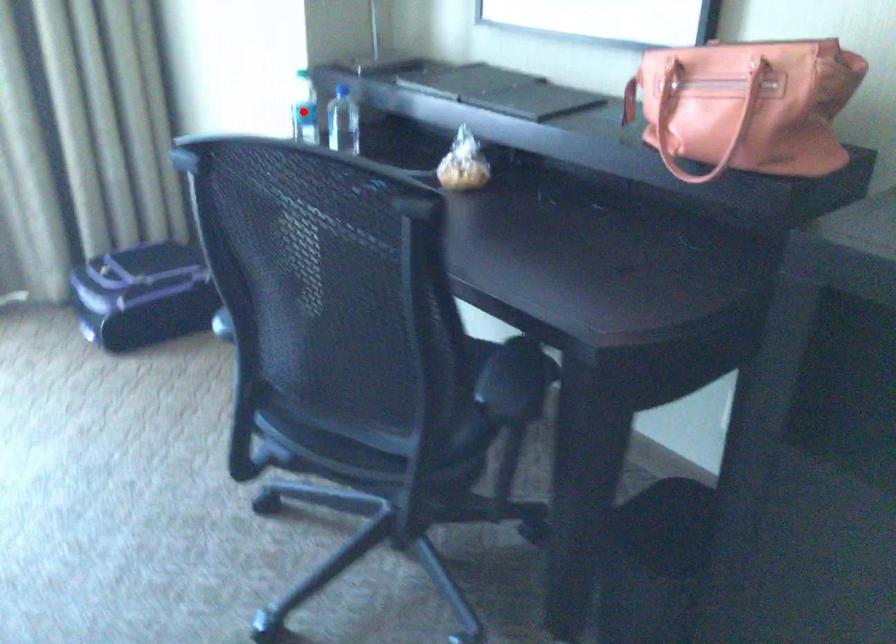
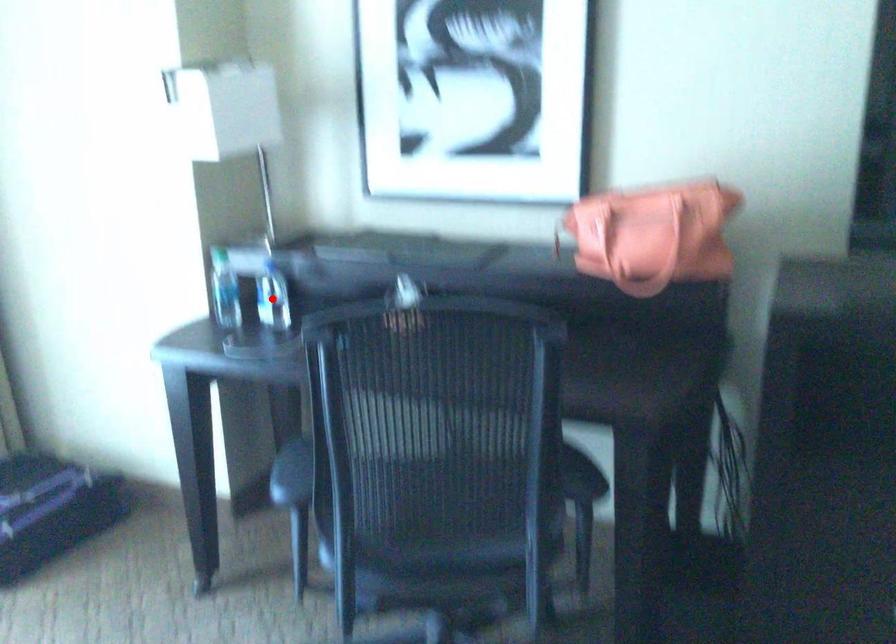
I am providing you with two images of the same scene from different viewpoints. A red point is marked on the first image and another point is marked on the second image. Is the red point in image1 aligned with the point shown in image2?

No